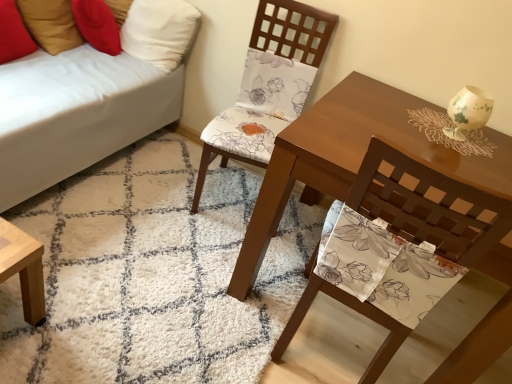
Locate an element on the screen. Image resolution: width=512 pixels, height=384 pixels. vacant point to the left of matte floral fabric chair at center, marked as the 2th chair in a front-to-back arrangement is located at coordinates (158, 180).